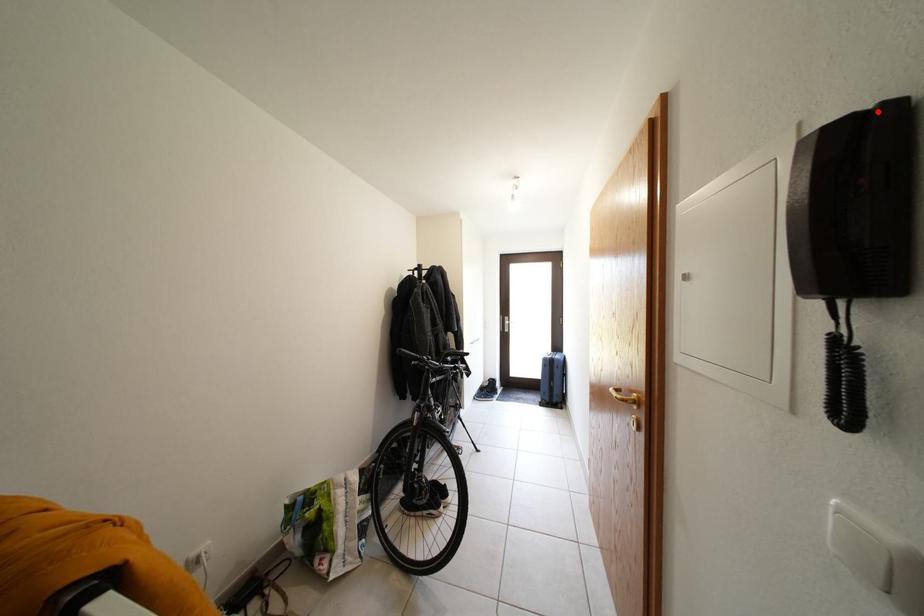
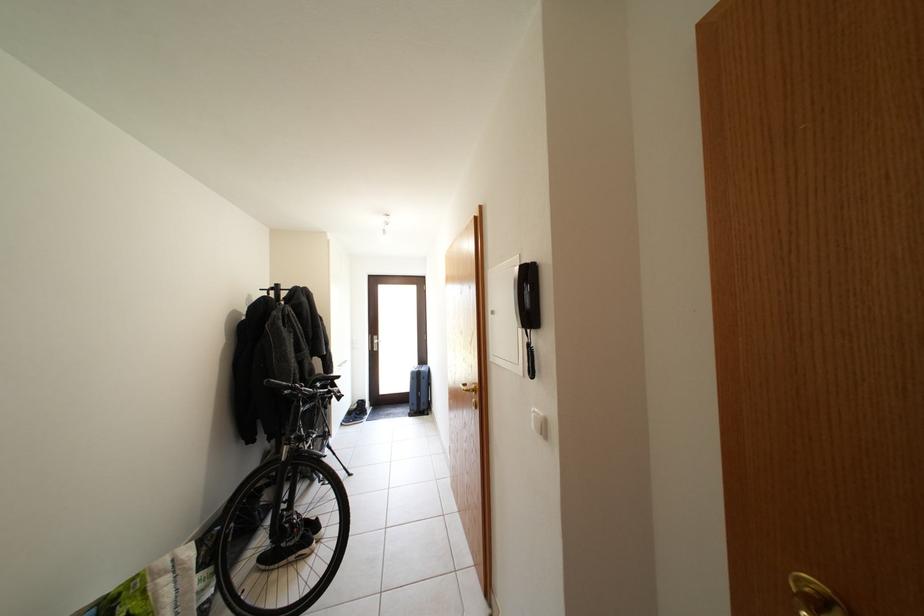
Locate, in the second image, the point that corresponds to the highlighted location in the first image.

(537, 267)